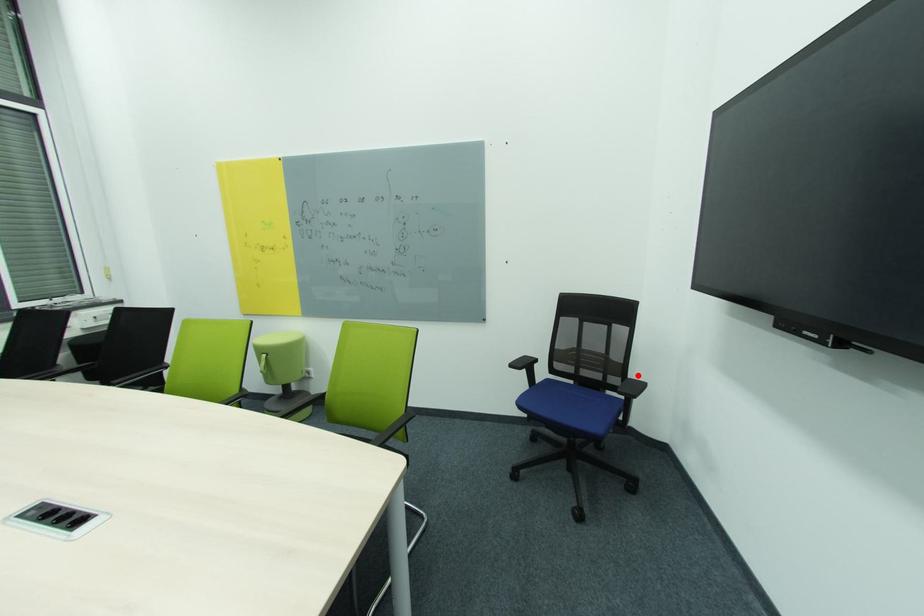
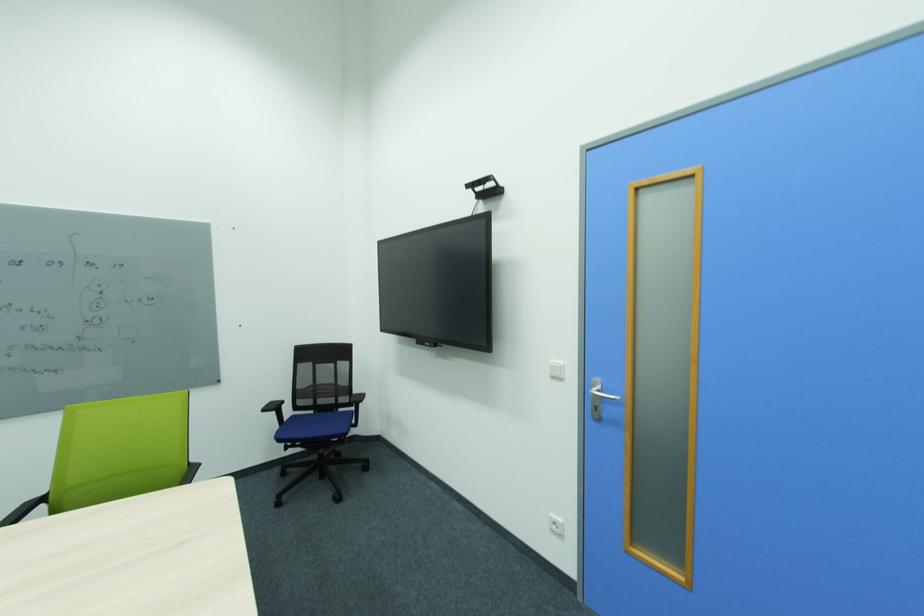
The point at the highlighted location is marked in the first image. Where is the corresponding point in the second image?

(360, 392)